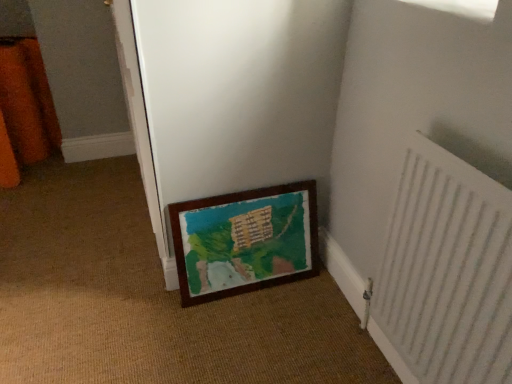
Question: From a real-world perspective, is wooden frame at lower center located higher than white textured radiator at lower right?

Choices:
 (A) yes
 (B) no

Answer: (B)

Question: Is wooden frame at lower center beside white textured radiator at lower right?

Choices:
 (A) no
 (B) yes

Answer: (A)

Question: Considering the relative positions of wooden frame at lower center and white textured radiator at lower right in the image provided, is wooden frame at lower center to the right of white textured radiator at lower right from the viewer's perspective?

Choices:
 (A) yes
 (B) no

Answer: (B)

Question: Is wooden frame at lower center bigger than white textured radiator at lower right?

Choices:
 (A) no
 (B) yes

Answer: (A)

Question: Does wooden frame at lower center lie behind white textured radiator at lower right?

Choices:
 (A) no
 (B) yes

Answer: (B)

Question: Is wooden frame at lower center inside or outside of white textured radiator at lower right?

Choices:
 (A) outside
 (B) inside

Answer: (A)

Question: Considering the positions of point (218, 213) and point (439, 317), is point (218, 213) closer or farther from the camera than point (439, 317)?

Choices:
 (A) farther
 (B) closer

Answer: (A)

Question: Is wooden frame at lower center wider or thinner than white textured radiator at lower right?

Choices:
 (A) wide
 (B) thin

Answer: (A)

Question: From a real-world perspective, relative to white textured radiator at lower right, is wooden frame at lower center vertically above or below?

Choices:
 (A) below
 (B) above

Answer: (A)

Question: Do you think wooden frame at lower center is within white textured radiator at lower right, or outside of it?

Choices:
 (A) inside
 (B) outside

Answer: (B)

Question: In terms of size, does wooden frame at lower center appear bigger or smaller than white textured radiator at lower right?

Choices:
 (A) small
 (B) big

Answer: (B)

Question: In terms of height, does wooden frame at lower center look taller or shorter compared to white textured radiator at lower right?

Choices:
 (A) short
 (B) tall

Answer: (B)

Question: In terms of width, does wooden frame at lower center look wider or thinner when compared to white textured radiator at lower right?

Choices:
 (A) thin
 (B) wide

Answer: (B)

Question: Looking at their shapes, would you say white textured radiator at lower right is wider or thinner than wooden frame at lower center?

Choices:
 (A) wide
 (B) thin

Answer: (B)

Question: Would you say white textured radiator at lower right is inside or outside wooden frame at lower center?

Choices:
 (A) outside
 (B) inside

Answer: (A)